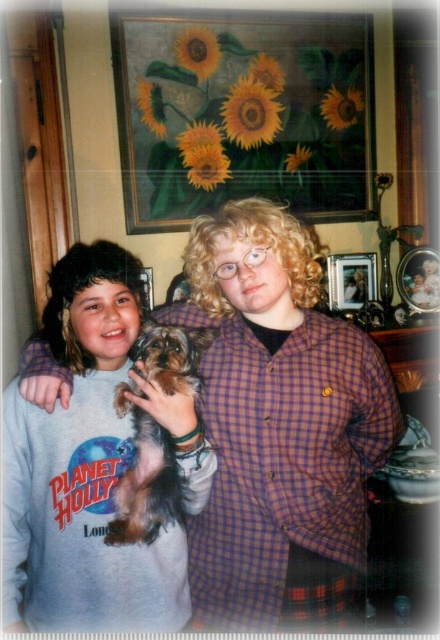
You are standing in the room and want to locate the plaid shirt at center. According to the coordinates provided, where would you find it?

The plaid shirt at center is located at the 2D coordinates point (279, 426).

You are a photographer setting up a shot in this scene. You want to ensure the plaid shirt at center and the fuzzy brown dog at center are both visible in the frame. Which one should you focus on first to make sure they are both in focus?

The plaid shirt at center is located above fuzzy brown dog at center, so focusing on the plaid shirt at center first will ensure both are in focus since it is higher up.

You are standing in the room and want to place a small plant between the two points, point 1 at point [201,611] and point 2 at point [32,522]. Which point should the plant be closer to in order to be closer to the viewer?

The plant should be closer to point 1 at point [201,611] because it is further to the viewer than point 2 at point [32,522].